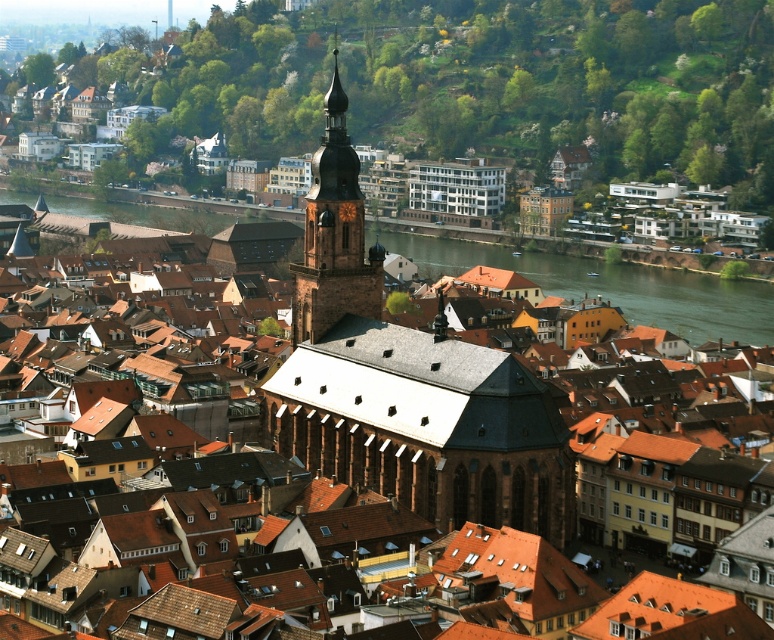
You are standing in the historic town and want to take a photo of the two points marked in the scene. Which point is closer to you, point at (368, 292) or point at (372, 260)?

Point at (368, 292) is closer to you than point at (372, 260).

You are a tourist standing on the bridge over the river in the town. You want to take a photo that includes both the green water at center and the brown stone bell tower at center. Can you fit both in your camera frame if your camera has a maximum horizontal field of view of 120 degrees?

The green water at center and brown stone bell tower at center are 135.29 meters apart. Since the camera has a maximum horizontal field of view of 120 degrees, which can cover a wider angle than the distance between the two objects, both can be captured in the same frame.

You are standing in the historic town and want to take a photo of both the point at coordinates point (389, 420) and point (663, 296). Which point will appear larger in your camera view?

Point (389, 420) is closer to the camera than point (663, 296), so it will appear larger in the photo.